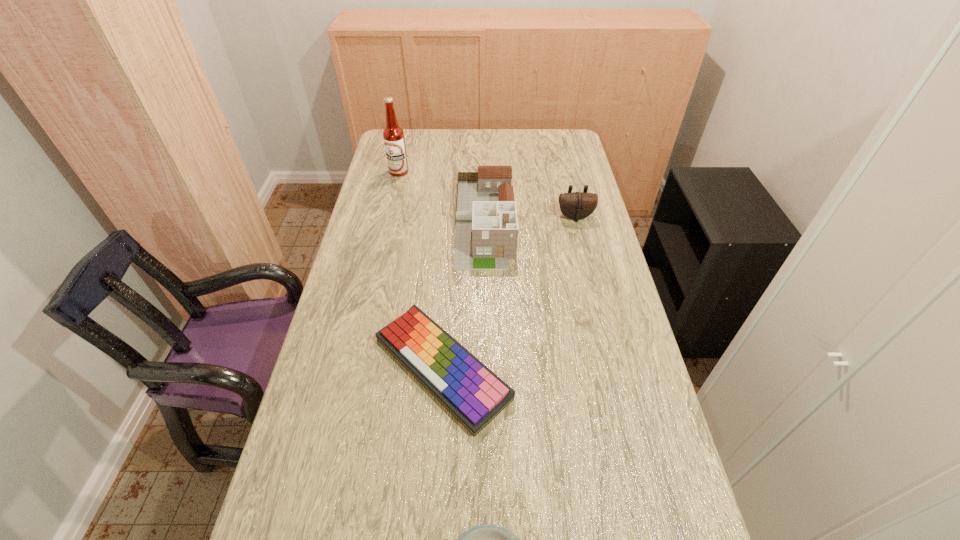
Locate an element on the screen. This screenshot has height=540, width=960. free space between the fourth farthest object and the second tallest object is located at coordinates (464, 294).

The image size is (960, 540). I want to click on free space that is in between the shortest object and the fourth shortest object, so click(464, 294).

This screenshot has width=960, height=540. I want to click on vacant area that lies between the third shortest object and the dollhouse, so click(530, 219).

Identify the location of vacant point located between the pouch and the dollhouse. This screenshot has height=540, width=960. (530, 219).

Identify the location of free space between the pouch and the second nearest object. The height and width of the screenshot is (540, 960). (509, 292).

This screenshot has width=960, height=540. In order to click on free space between the rightmost object and the computer keyboard in this screenshot , I will do `click(509, 292)`.

I want to click on vacant area that lies between the pouch and the second tallest object, so click(530, 219).

Find the location of a particular element. The image size is (960, 540). the second closest object relative to the fourth farthest object is located at coordinates (486, 539).

Select which object appears as the fourth closest to the farthest object. Please provide its 2D coordinates. Your answer should be formatted as a tuple, i.e. [(x, y)], where the tuple contains the x and y coordinates of a point satisfying the conditions above.

[(486, 539)]

Image resolution: width=960 pixels, height=540 pixels. In order to click on free location that satisfies the following two spatial constraints: 1. on the label side of the farthest object; 2. on the right side of the fourth farthest object in this screenshot , I will do `click(354, 368)`.